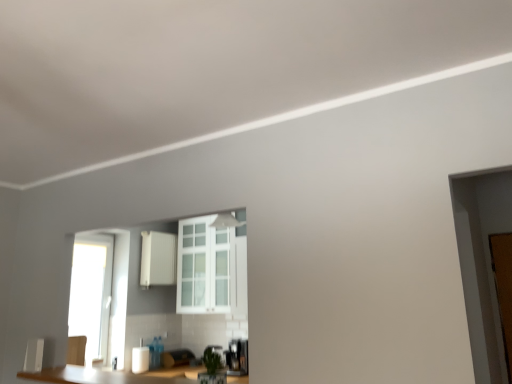
Question: In terms of width, does brown wooden door at right look wider or thinner when compared to white glossy paper towel dispenser at lower center?

Choices:
 (A) wide
 (B) thin

Answer: (B)

Question: Considering their positions, is brown wooden door at right located in front of or behind white glossy paper towel dispenser at lower center?

Choices:
 (A) front
 (B) behind

Answer: (A)

Question: Which object is positioned closest to the white matte cabinet at center?

Choices:
 (A) white glossy paper towel dispenser at lower center
 (B) white glass cabinet at center
 (C) brown wooden door at right

Answer: (B)

Question: Which is nearer to the white glass cabinet at center?

Choices:
 (A) white matte cabinet at center
 (B) white glossy paper towel dispenser at lower center
 (C) brown wooden door at right

Answer: (A)